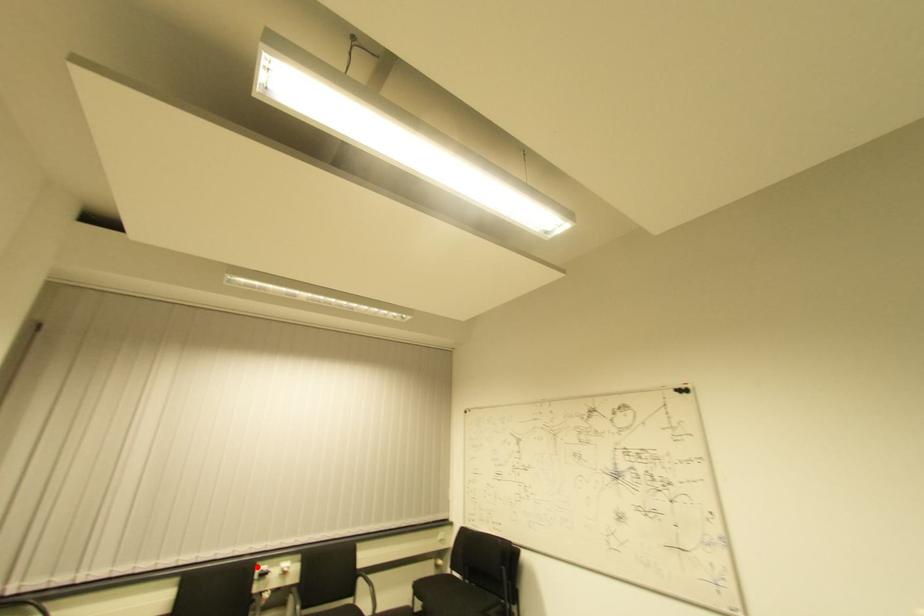
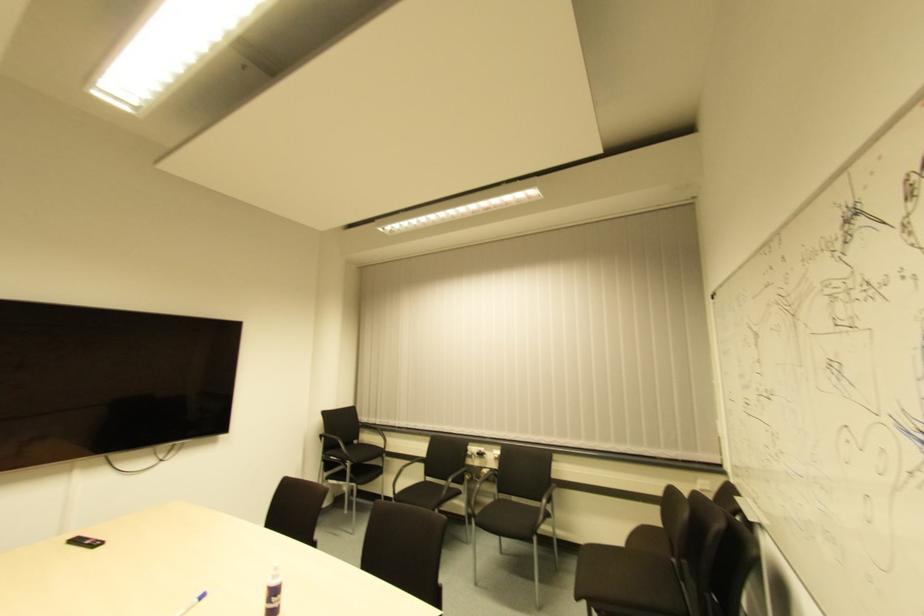
Question: I am providing you with two images of the same scene from different viewpoints. Given a red point in image1, look at the same physical point in image2. Is it:

Choices:
 (A) Closer to the viewpoint
 (B) Farther from the viewpoint

Answer: (B)